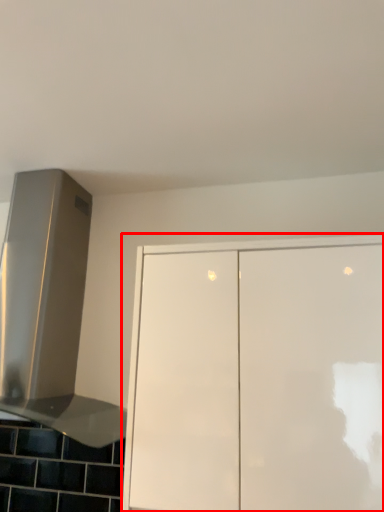
Question: From the image's perspective, where is cabinetry (annotated by the red box) located in relation to vent in the image?

Choices:
 (A) below
 (B) above

Answer: (A)